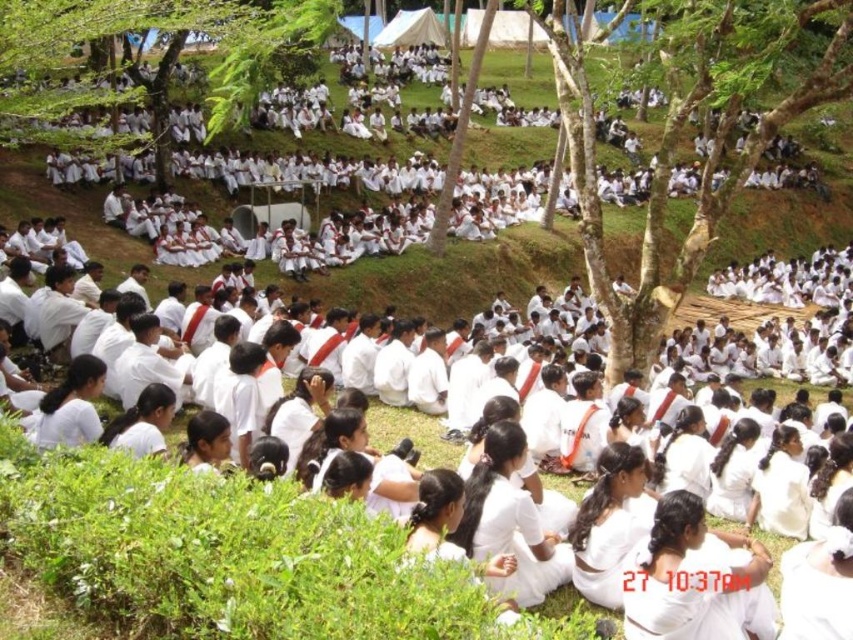
Question: Does smooth bark tree at center have a larger size compared to green leafy tree at upper left?

Choices:
 (A) no
 (B) yes

Answer: (B)

Question: Is smooth bark tree at center above green leafy tree at upper left?

Choices:
 (A) no
 (B) yes

Answer: (B)

Question: Observing the image, what is the correct spatial positioning of smooth bark tree at center in reference to green leafy tree at upper left?

Choices:
 (A) left
 (B) right

Answer: (B)

Question: Which of the following is the farthest from the observer?

Choices:
 (A) smooth bark tree at center
 (B) green leafy tree at upper left

Answer: (A)

Question: Which point is closer to the camera?

Choices:
 (A) green leafy tree at upper left
 (B) smooth bark tree at center

Answer: (A)

Question: Which object appears farthest from the camera in this image?

Choices:
 (A) green leafy tree at upper left
 (B) smooth bark tree at center

Answer: (B)